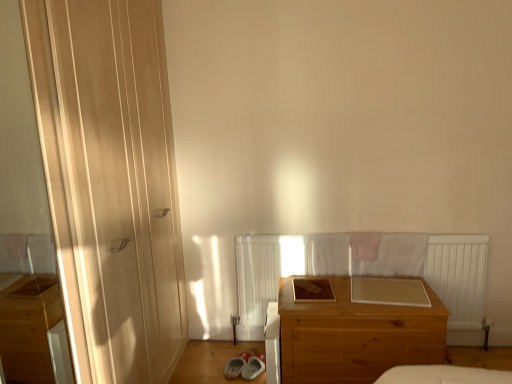
Question: In the image, is matte wood door at left positioned in front of or behind wooden chest of drawers at center?

Choices:
 (A) behind
 (B) front

Answer: (B)

Question: Is point [x=81, y=301] positioned closer to the camera than point [x=394, y=345]?

Choices:
 (A) closer
 (B) farther

Answer: (A)

Question: Estimate the real-world distances between objects in this image. Which object is farther from the matte wood door at left?

Choices:
 (A) wooden chest of drawers at center
 (B) transparent glass screen door at left

Answer: (B)

Question: Which object is positioned farthest from the transparent glass screen door at left?

Choices:
 (A) wooden chest of drawers at center
 (B) matte wood door at left

Answer: (A)